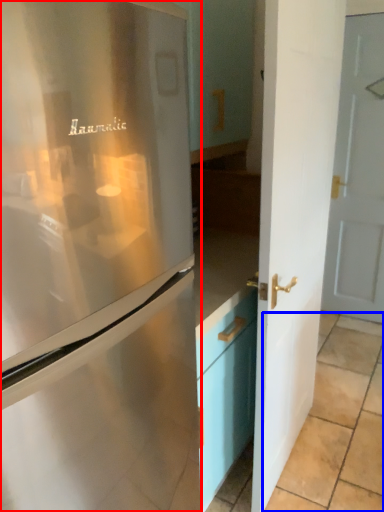
Question: Among these objects, which one is farthest to the camera, refrigerator (highlighted by a red box) or tile (highlighted by a blue box)?

Choices:
 (A) refrigerator
 (B) tile

Answer: (B)